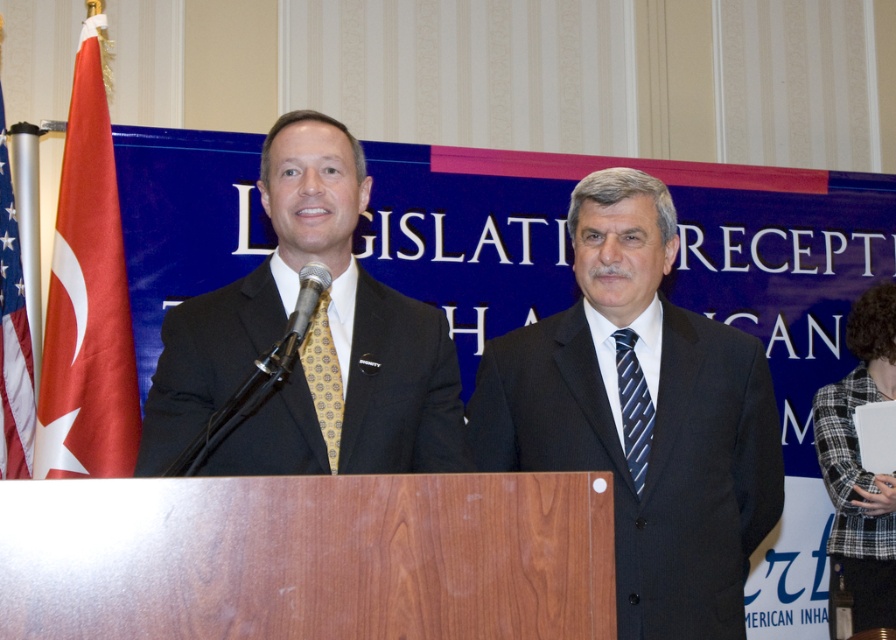
Image resolution: width=896 pixels, height=640 pixels. I want to click on matte black suit at center, so click(x=309, y=340).

Is matte black suit at center positioned before plaid wool jacket at lower right?

Yes, matte black suit at center is closer to the viewer.

I want to click on matte black suit at center, so click(x=309, y=340).

Does dark gray suit at center lie in front of plaid wool jacket at lower right?

Yes, dark gray suit at center is closer to the viewer.

Locate an element on the screen. dark gray suit at center is located at coordinates (642, 416).

Is plaid wool jacket at lower right to the left of blue striped tie at right from the viewer's perspective?

No, plaid wool jacket at lower right is not to the left of blue striped tie at right.

Can you confirm if plaid wool jacket at lower right is shorter than blue striped tie at right?

No.

Find the location of a particular element. plaid wool jacket at lower right is located at coordinates (859, 472).